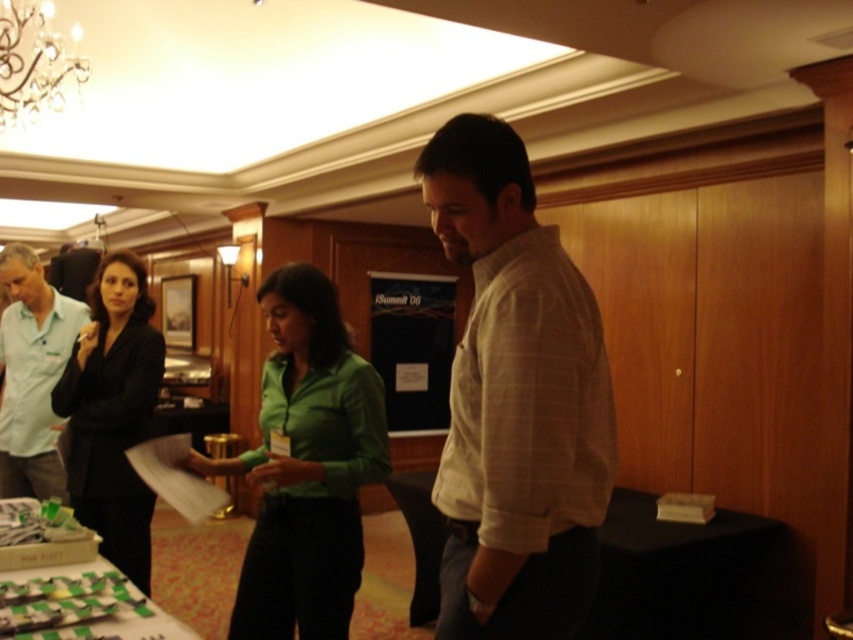
The image size is (853, 640). I want to click on green matte shirt at center, so click(x=306, y=465).

Between point (335, 301) and point (112, 410), which one is positioned behind?

The point (112, 410) is more distant.

This screenshot has width=853, height=640. Find the location of `green matte shirt at center`. green matte shirt at center is located at coordinates (306, 465).

How much distance is there between green matte shirt at center and crystal glass chandelier at upper left?

A distance of 1.65 meters exists between green matte shirt at center and crystal glass chandelier at upper left.

Which is in front, point (329, 333) or point (39, 100)?

Point (329, 333) is more forward.

Between point (318, 304) and point (47, 109), which one is positioned in front?

Point (318, 304)

Identify the location of green matte shirt at center. The image size is (853, 640). [x=306, y=465].

Between green striped fabric at lower left and crystal glass chandelier at upper left, which one appears on the right side from the viewer's perspective?

green striped fabric at lower left

Between green striped fabric at lower left and crystal glass chandelier at upper left, which one has less height?

green striped fabric at lower left is shorter.

You are a GUI agent. You are given a task and a screenshot of the screen. Output one action in this format:
    pyautogui.click(x=<x>, y=<y>)
    Task: Click on the green striped fabric at lower left
    
    Given the screenshot: What is the action you would take?
    pyautogui.click(x=74, y=596)